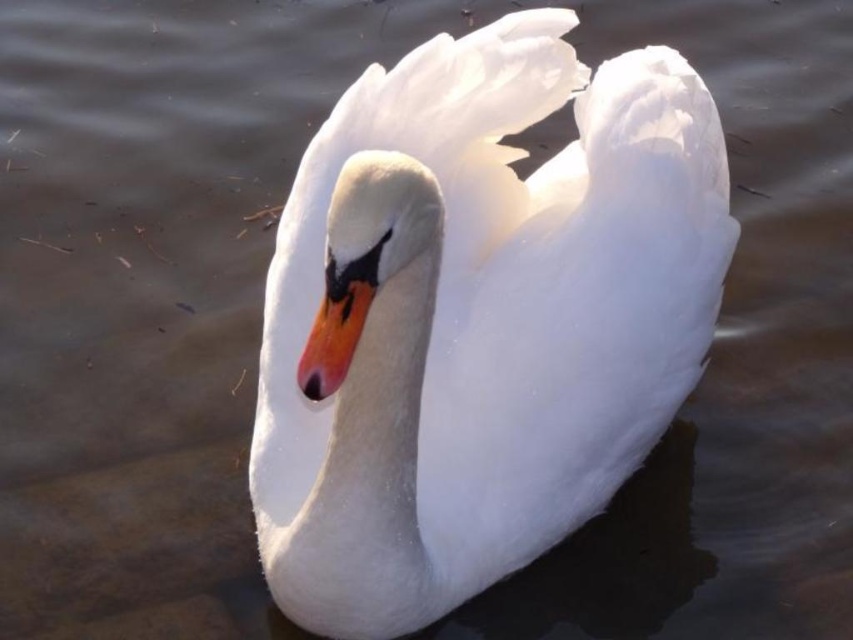
Question: Can you confirm if white glossy swan at center is positioned below orange glossy beak at center?

Choices:
 (A) yes
 (B) no

Answer: (A)

Question: Where is white glossy swan at center located in relation to orange glossy beak at center in the image?

Choices:
 (A) below
 (B) above

Answer: (A)

Question: Which point is farther to the camera?

Choices:
 (A) orange glossy beak at center
 (B) white glossy swan at center

Answer: (B)

Question: Is white glossy swan at center below orange glossy beak at center?

Choices:
 (A) yes
 (B) no

Answer: (A)